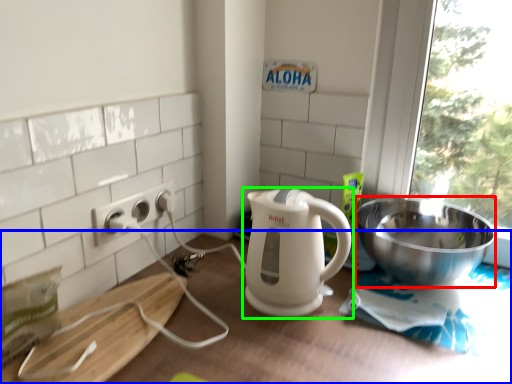
Question: Which object is positioned farthest from bowl (highlighted by a red box)? Select from table (highlighted by a blue box) and kitchen appliance (highlighted by a green box).

Choices:
 (A) table
 (B) kitchen appliance

Answer: (B)